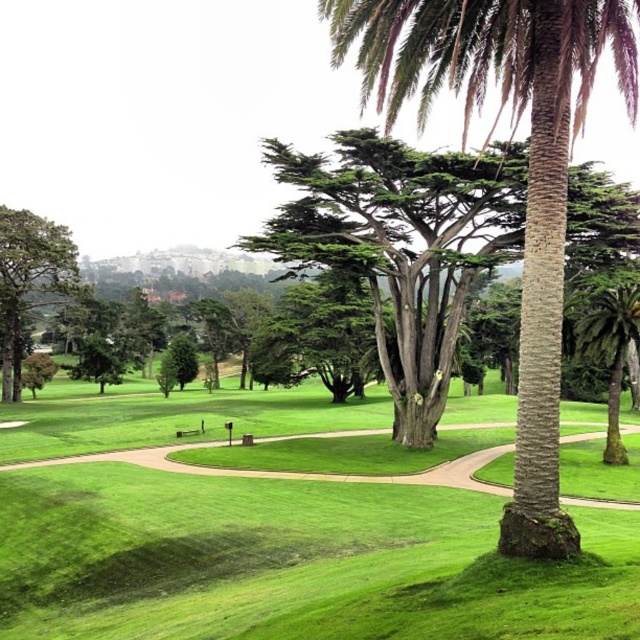
Which is behind, point (492, 417) or point (598, 352)?

The point (492, 417) is behind.

Between green grass at center and green mossy palm tree at right, which one is positioned lower?

green grass at center is below.

What do you see at coordinates (291, 561) in the screenshot? I see `green grass at center` at bounding box center [291, 561].

Identify the location of green grass at center. Image resolution: width=640 pixels, height=640 pixels. pos(291,561).

Does green textured palm tree at center have a greater width compared to green matte tree at left?

Indeed, green textured palm tree at center has a greater width compared to green matte tree at left.

Who is higher up, green textured palm tree at center or green matte tree at left?

green textured palm tree at center

The image size is (640, 640). I want to click on green textured palm tree at center, so click(528, 173).

Find the location of a particular element. The image size is (640, 640). green textured palm tree at center is located at coordinates (528, 173).

Is green textured palm tree at center positioned at the back of green mossy palm tree at right?

No, green textured palm tree at center is closer to the viewer.

The height and width of the screenshot is (640, 640). What do you see at coordinates (528, 173) in the screenshot?
I see `green textured palm tree at center` at bounding box center [528, 173].

Between point (548, 547) and point (596, 330), which one is positioned in front?

Point (548, 547)

Where is `green textured palm tree at center`? The width and height of the screenshot is (640, 640). green textured palm tree at center is located at coordinates (528, 173).